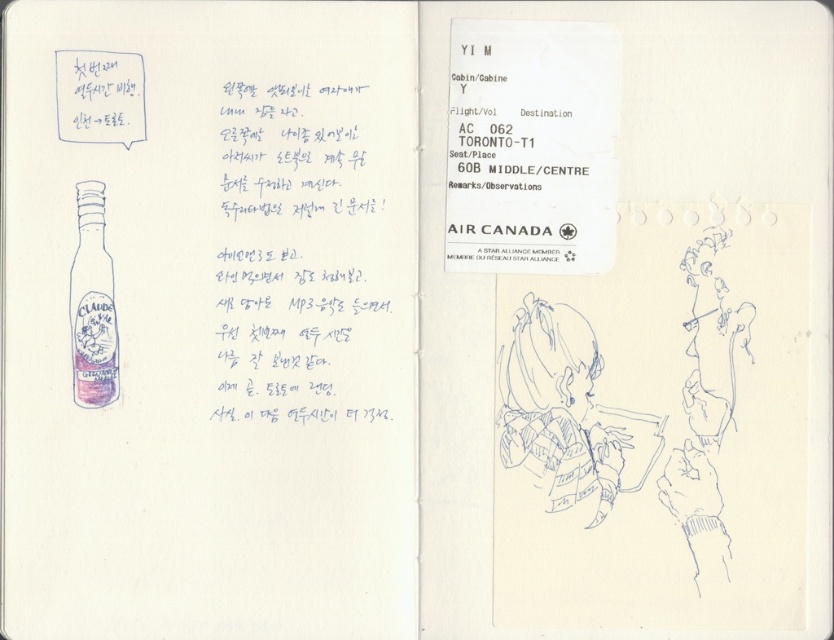
Is point (333, 198) positioned in front of point (84, 349)?

No, it is not.

Locate an element on the screen. black paper at center is located at coordinates (294, 250).

I want to click on black paper at center, so click(x=294, y=250).